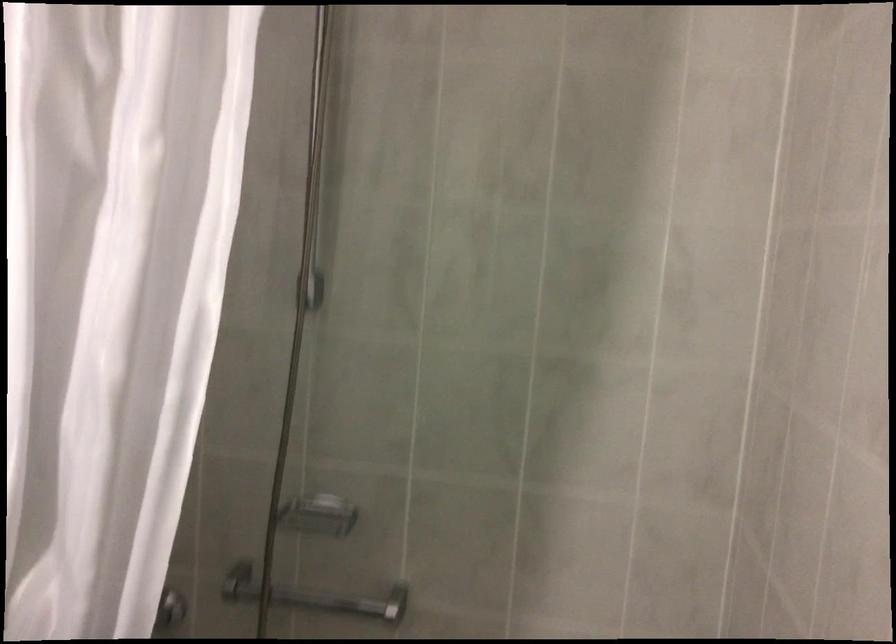
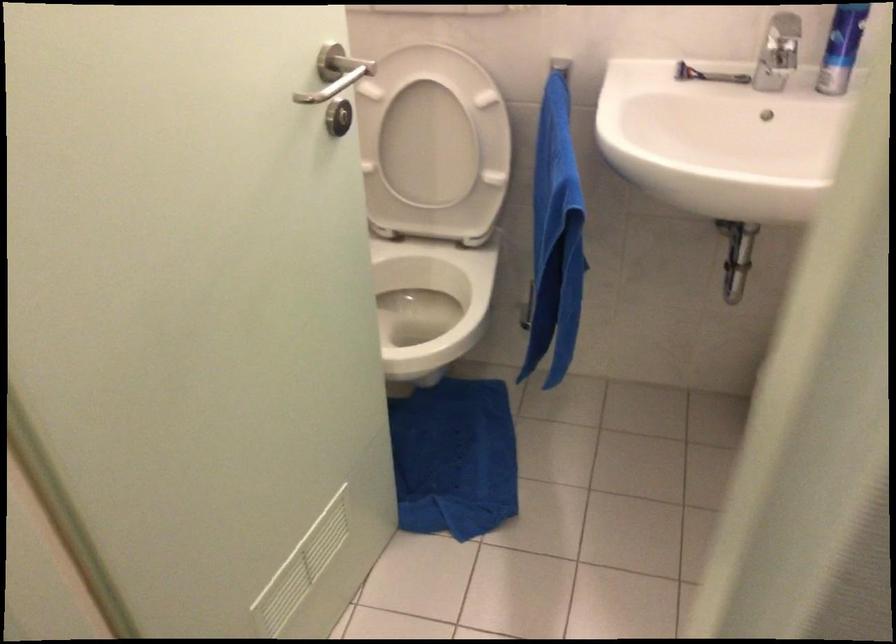
In the scene shown: First-person continuous shooting, in which direction is the camera rotating?

The camera rotated toward left-down.